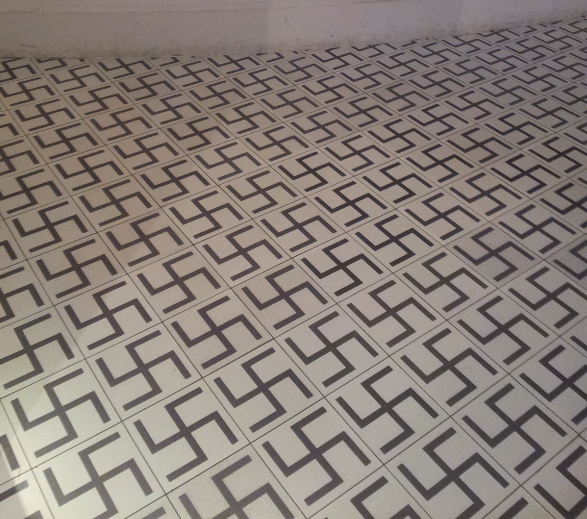
This screenshot has width=587, height=519. I want to click on tile, so click(x=526, y=94).